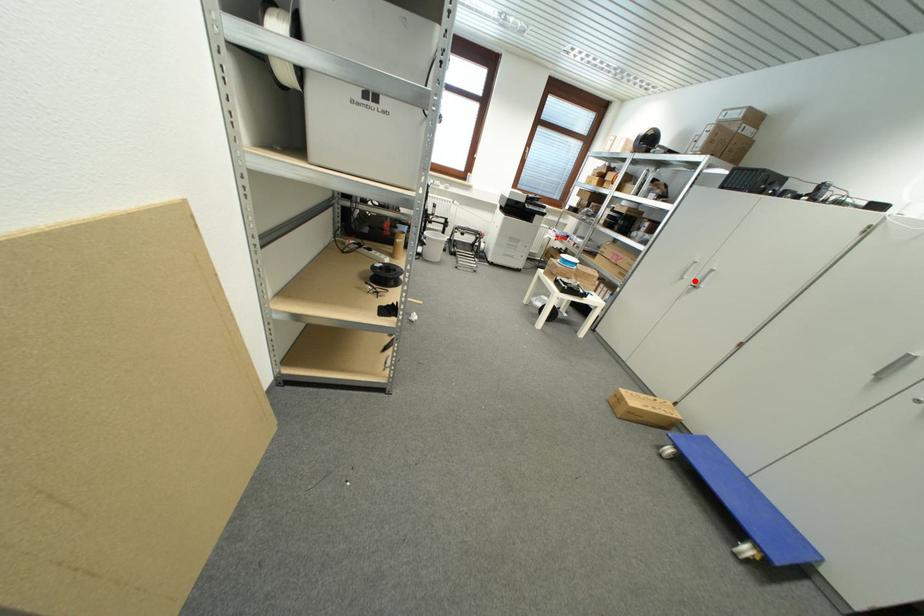
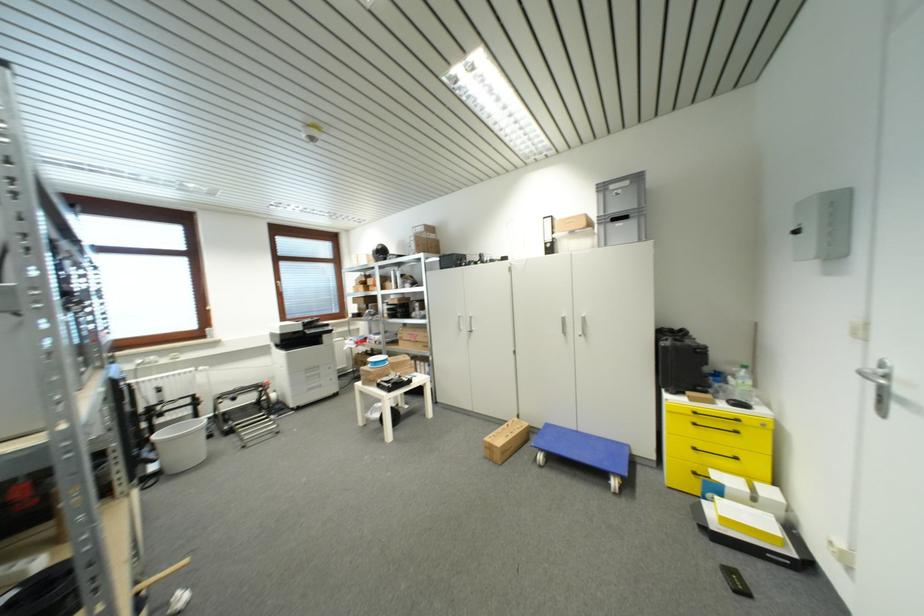
Where in the second image is the point corresponding to the highlighted location from the first image?

(468, 330)